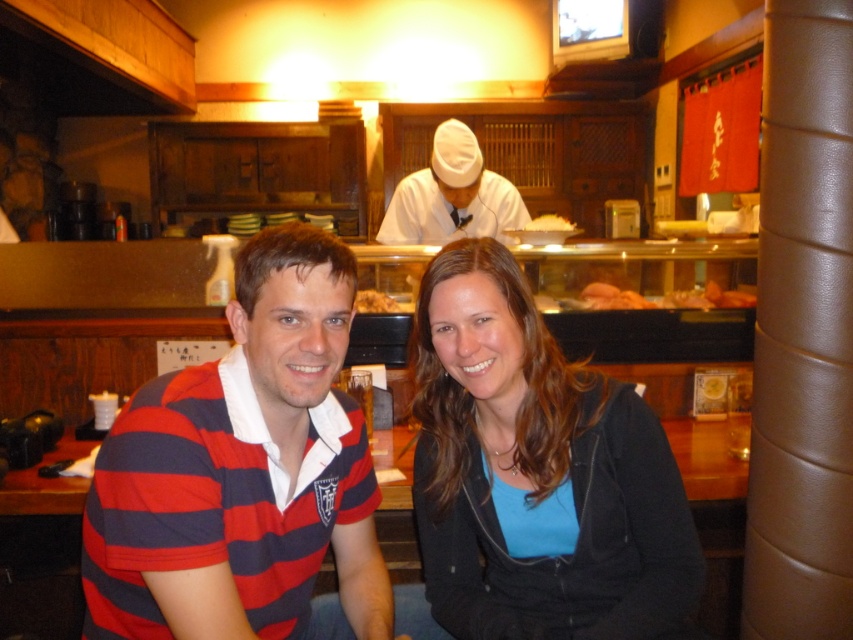
Does point (291, 339) come in front of point (550, 212)?

Yes, point (291, 339) is in front of point (550, 212).

Does striped cotton polo shirt at center have a lesser width compared to yellowish matte sushi at center?

In fact, striped cotton polo shirt at center might be wider than yellowish matte sushi at center.

Locate an element on the screen. striped cotton polo shirt at center is located at coordinates (242, 470).

Does shiny pink salmon at center appear on the left side of yellowish matte sushi at center?

Yes, shiny pink salmon at center is to the left of yellowish matte sushi at center.

Is point (357, 292) closer to camera compared to point (527, 225)?

That is True.

I want to click on shiny pink salmon at center, so click(x=375, y=301).

Which is below, blue matte shirt at center or white matte chef hat at upper center?

Positioned lower is blue matte shirt at center.

Does blue matte shirt at center have a lesser width compared to white matte chef hat at upper center?

Yes.

Is point (566, 625) positioned behind point (476, 198)?

No, it is in front of (476, 198).

In order to click on blue matte shirt at center in this screenshot , I will do `click(537, 474)`.